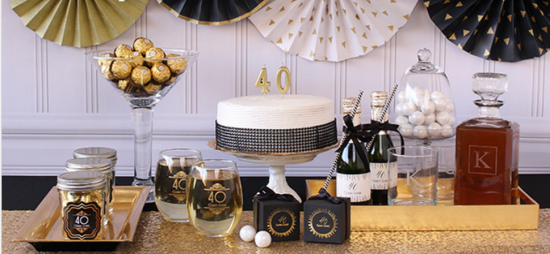
I want to click on back wall, so click(55, 82).